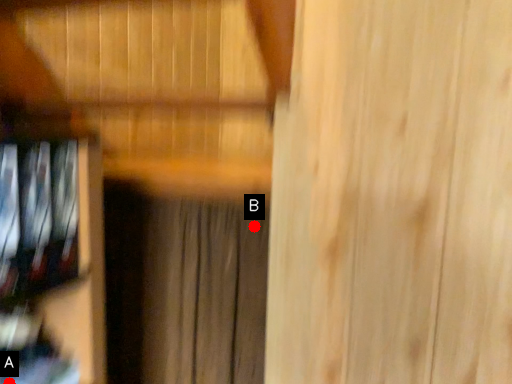
Question: Two points are circled on the image, labeled by A and B beside each circle. Which point is farther from the camera taking this photo?

Choices:
 (A) A is further
 (B) B is further

Answer: (B)